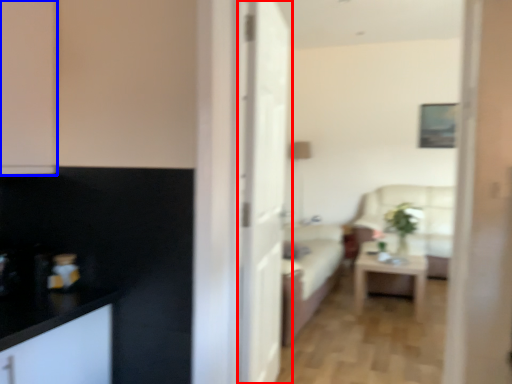
Question: Which point is further to the camera, door (highlighted by a red box) or cabinetry (highlighted by a blue box)?

Choices:
 (A) door
 (B) cabinetry

Answer: (A)